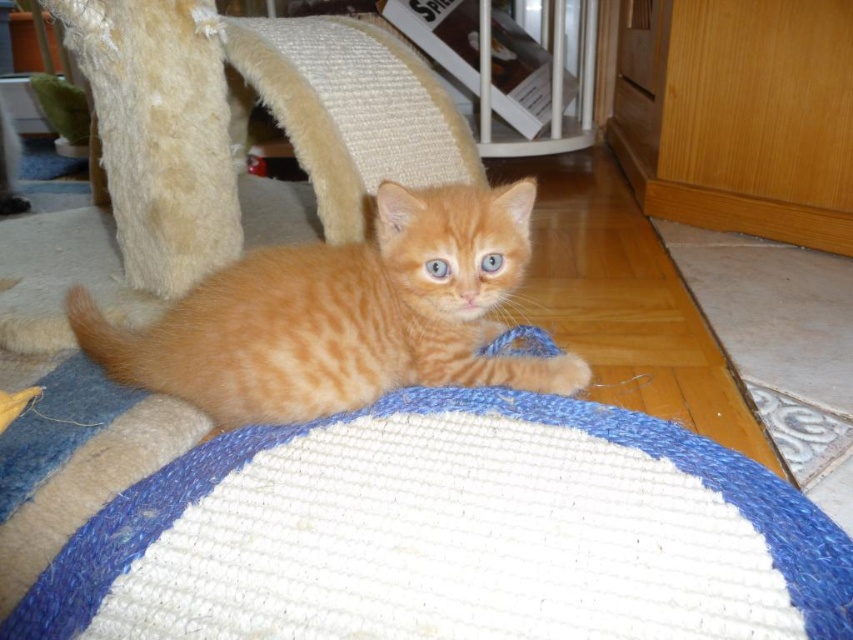
Question: From the image, what is the correct spatial relationship of white knitted cat bed at center in relation to orange fur cat at center?

Choices:
 (A) below
 (B) above

Answer: (A)

Question: Observing the image, what is the correct spatial positioning of white knitted cat bed at center in reference to orange fur cat at center?

Choices:
 (A) below
 (B) above

Answer: (A)

Question: Which object is farther from the camera taking this photo?

Choices:
 (A) white knitted cat bed at center
 (B) orange fur cat at center

Answer: (B)

Question: Which of the following is the farthest from the observer?

Choices:
 (A) white knitted cat bed at center
 (B) orange fur cat at center

Answer: (B)

Question: Considering the relative positions of white knitted cat bed at center and orange fur cat at center in the image provided, where is white knitted cat bed at center located with respect to orange fur cat at center?

Choices:
 (A) above
 (B) below

Answer: (B)